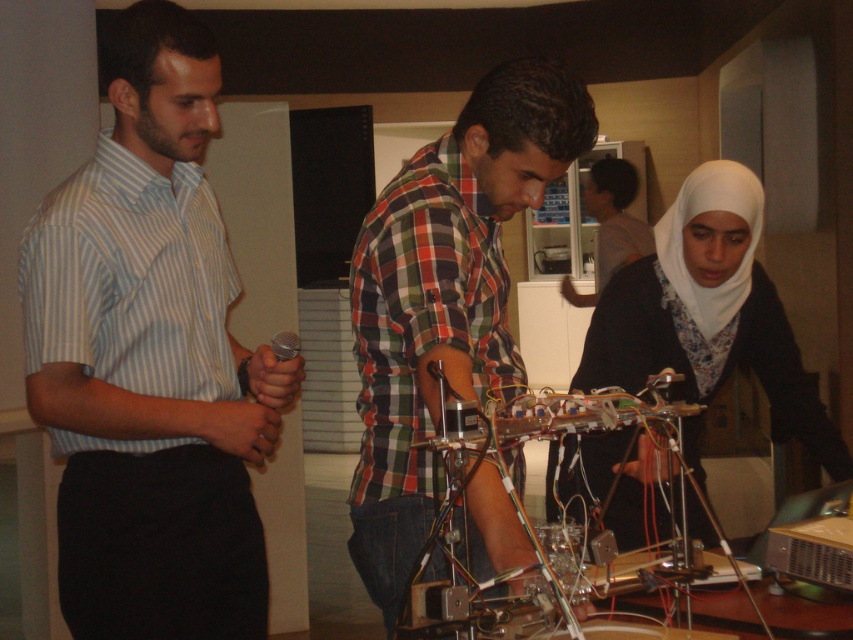
Question: Which is farther from the plaid shirt at center?

Choices:
 (A) checkered fabric shirt at center
 (B) light blue striped shirt at left

Answer: (B)

Question: Does light blue striped shirt at left appear on the left side of checkered fabric shirt at center?

Choices:
 (A) yes
 (B) no

Answer: (A)

Question: Observing the image, what is the correct spatial positioning of light blue striped shirt at left in reference to white matte hijab at center?

Choices:
 (A) left
 (B) right

Answer: (A)

Question: Is checkered fabric shirt at center above white matte hijab at center?

Choices:
 (A) yes
 (B) no

Answer: (A)

Question: Which object is farther from the camera taking this photo?

Choices:
 (A) light blue striped shirt at left
 (B) white matte hijab at center

Answer: (B)

Question: Estimate the real-world distances between objects in this image. Which object is closer to the plaid shirt at center?

Choices:
 (A) light blue striped shirt at left
 (B) white matte hijab at center

Answer: (B)